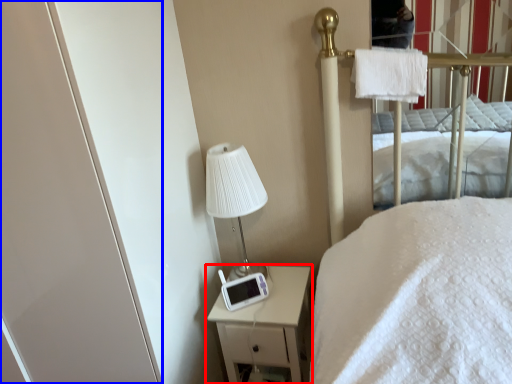
Question: Which object appears farthest to the camera in this image, nightstand (highlighted by a red box) or screen door (highlighted by a blue box)?

Choices:
 (A) nightstand
 (B) screen door

Answer: (A)